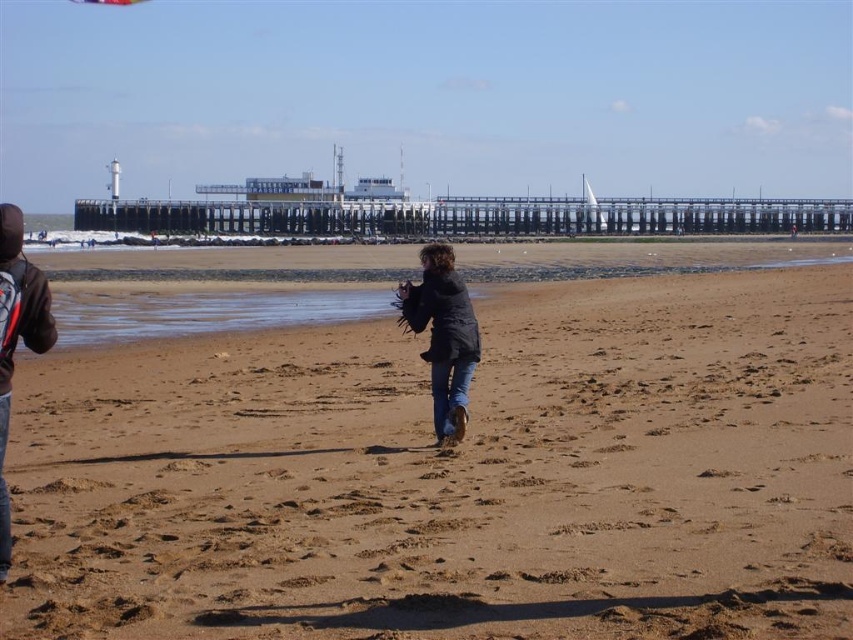
Question: Considering the real-world distances, which object is farthest from the brown sandy beach at center?

Choices:
 (A) dark blue hoodie at left
 (B) dark gray jacket at center

Answer: (A)

Question: Can you confirm if brown sandy beach at center is bigger than dark gray jacket at center?

Choices:
 (A) no
 (B) yes

Answer: (B)

Question: Which of the following is the closest to the observer?

Choices:
 (A) (12, 264)
 (B) (389, 547)

Answer: (A)

Question: Is brown sandy beach at center above dark blue hoodie at left?

Choices:
 (A) no
 (B) yes

Answer: (A)

Question: Which of the following is the farthest from the observer?

Choices:
 (A) brown sandy beach at center
 (B) dark blue hoodie at left
 (C) dark gray jacket at center

Answer: (C)

Question: Does dark gray jacket at center come behind dark blue hoodie at left?

Choices:
 (A) no
 (B) yes

Answer: (B)